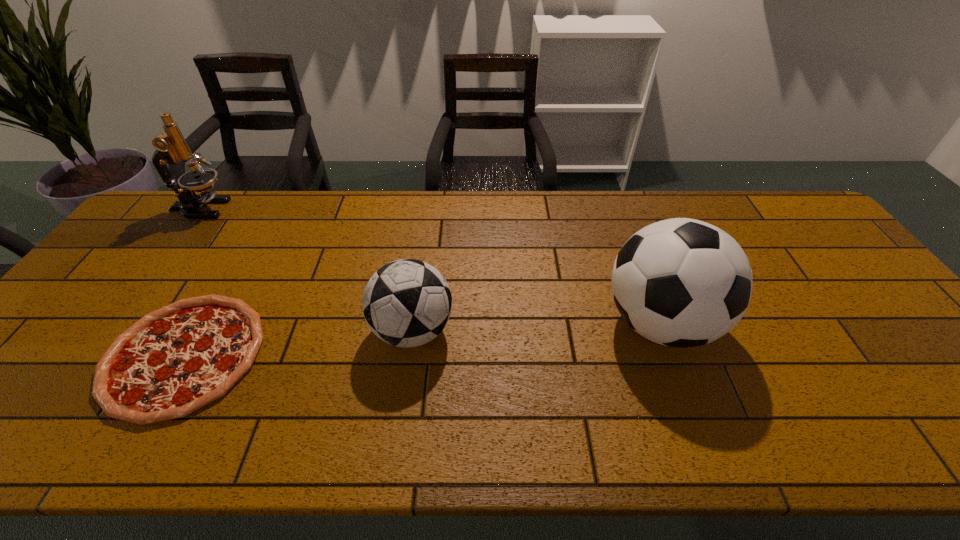
Find the location of a particular element. This screenshot has width=960, height=540. empty space that is in between the left soccer ball and the rightmost object is located at coordinates (537, 327).

Identify the location of free space between the taller soccer ball and the third tallest object. (537, 327).

I want to click on object that is the third closest to the shorter soccer ball, so click(171, 147).

The image size is (960, 540). I want to click on object identified as the second closest to the left soccer ball, so click(x=680, y=282).

Identify the location of free space that satisfies the following two spatial constraints: 1. at the eyepiece of the farthest object; 2. on the right side of the pizza. This screenshot has height=540, width=960. coord(92,355).

Image resolution: width=960 pixels, height=540 pixels. I want to click on free space that satisfies the following two spatial constraints: 1. at the eyepiece of the farthest object; 2. on the left side of the right soccer ball, so click(x=116, y=323).

Find the location of a particular element. This screenshot has height=540, width=960. free location that satisfies the following two spatial constraints: 1. at the eyepiece of the shortest object; 2. on the right side of the microscope is located at coordinates (92, 355).

The height and width of the screenshot is (540, 960). What are the coordinates of `vacant region that satisfies the following two spatial constraints: 1. at the eyepiece of the farthest object; 2. on the right side of the right soccer ball` in the screenshot? It's located at (116, 323).

At what (x,y) coordinates should I click in order to perform the action: click on vacant space that satisfies the following two spatial constraints: 1. at the eyepiece of the rightmost object; 2. on the right side of the farthest object. Please return your answer as a coordinate pair (x, y). Looking at the image, I should click on (116, 323).